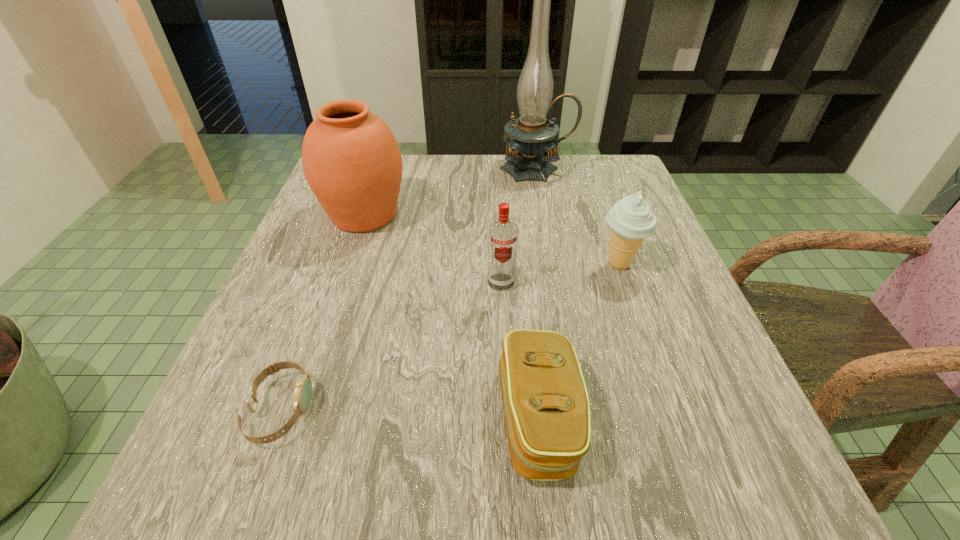
In order to click on urn situated at the left edge in this screenshot , I will do `click(351, 160)`.

The width and height of the screenshot is (960, 540). Identify the location of watch present at the left edge. (303, 391).

At what (x,y) coordinates should I click in order to perform the action: click on oil lamp situated at the right edge. Please return your answer as a coordinate pair (x, y). The image size is (960, 540). Looking at the image, I should click on (530, 137).

Find the location of a particular element. The width and height of the screenshot is (960, 540). icecream located in the right edge section of the desktop is located at coordinates (631, 220).

Where is `object that is at the far left corner`? The width and height of the screenshot is (960, 540). object that is at the far left corner is located at coordinates (351, 160).

Find the location of a particular element. This screenshot has height=540, width=960. object at the near left corner is located at coordinates (303, 391).

What are the coordinates of `object positioned at the far right corner` in the screenshot? It's located at (530, 137).

In the image, there is a desktop. Where is `blank space at the far edge`? The image size is (960, 540). blank space at the far edge is located at coordinates (492, 163).

The width and height of the screenshot is (960, 540). In the image, there is a desktop. Identify the location of free region at the left edge. (335, 345).

Identify the location of vacant space at the right edge of the desktop. (737, 433).